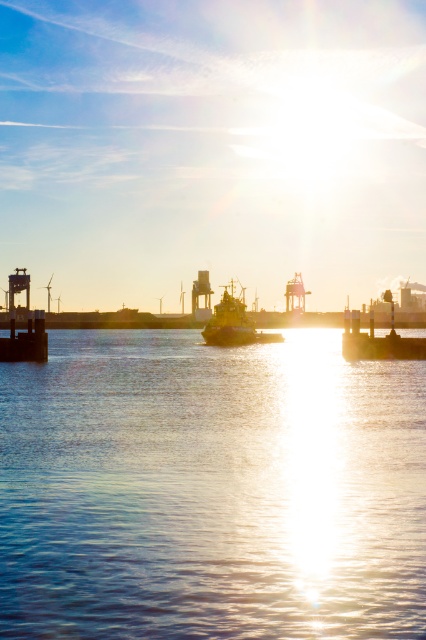
Is glistening water at center positioned at the back of shiny metallic tugboat at center?

That is False.

Who is higher up, glistening water at center or shiny metallic tugboat at center?

shiny metallic tugboat at center is higher up.

Is point (71, 596) positioned before point (249, 332)?

Yes, it is.

Where is `glistening water at center`? The width and height of the screenshot is (426, 640). glistening water at center is located at coordinates (210, 490).